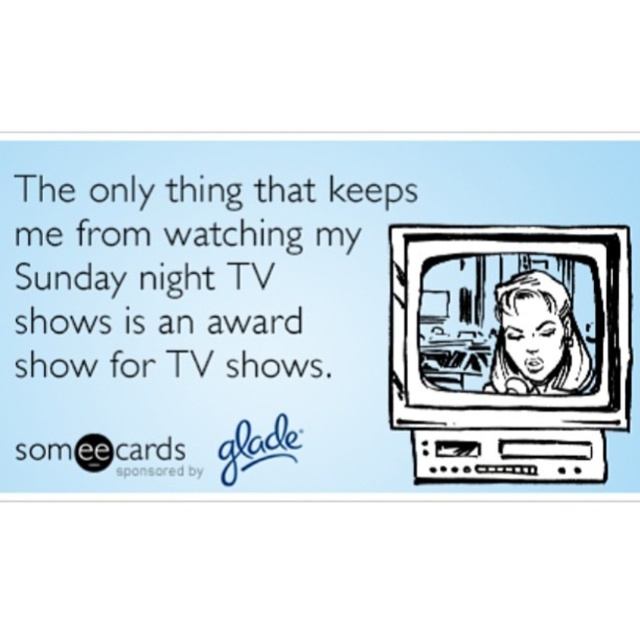
Based on the scene description, where is the black ink drawing of a woman at center located in the image?

The black ink drawing of a woman at center is located at point (512,326).

Looking at the image described, which object is wider between the black ink drawing of a woman at center and the smooth black hair at center?

The black ink drawing of a woman at center is wider than the smooth black hair at center.

In the scene shown: Looking at the image, which object is positioned closer to you between the black ink drawing of a woman at center and the smooth black hair at center?

The black ink drawing of a woman at center is closer to the viewer than the smooth black hair at center.